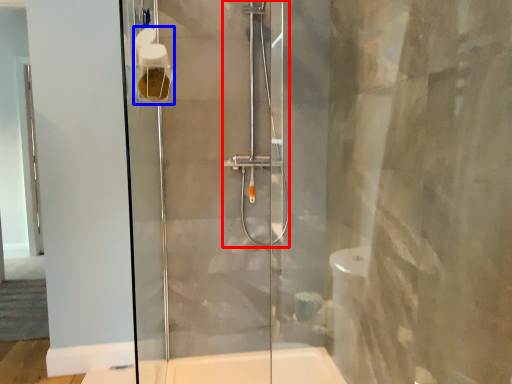
Question: Among these objects, which one is farthest to the camera, shower (highlighted by a red box) or toilet paper (highlighted by a blue box)?

Choices:
 (A) shower
 (B) toilet paper

Answer: (A)